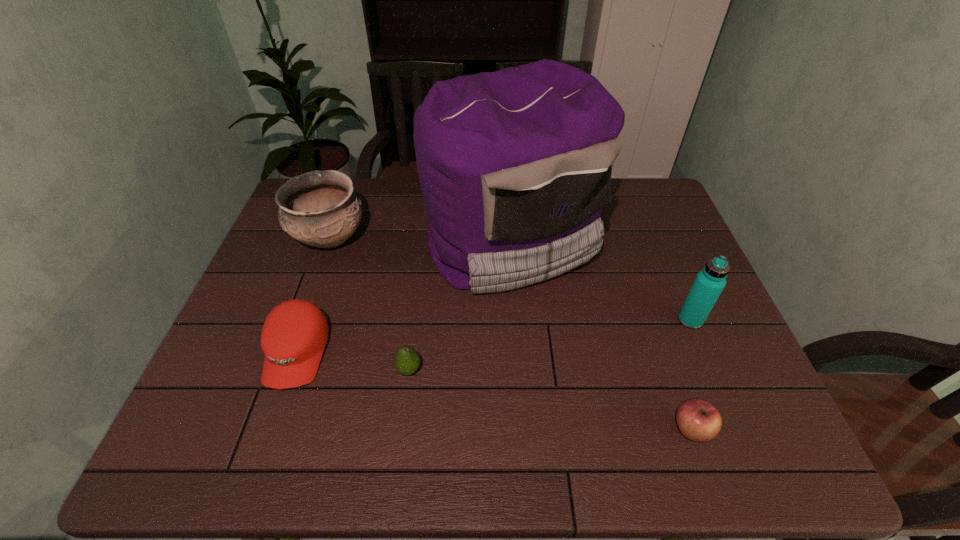
At what (x,y) coordinates should I click in order to perform the action: click on vacant space that satisfies the following two spatial constraints: 1. on the front-facing side of the avocado; 2. on the left side of the cap. Please return your answer as a coordinate pair (x, y). This screenshot has height=540, width=960. Looking at the image, I should click on (292, 370).